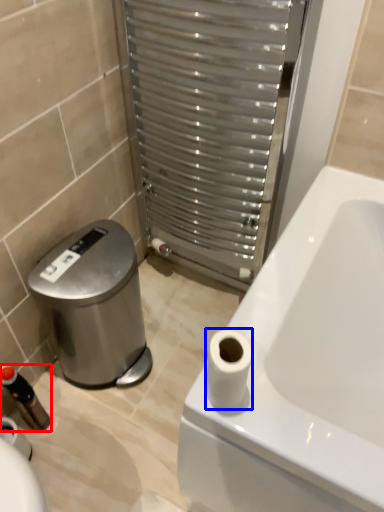
Question: Which object appears closest to the camera in this image, toiletry (highlighted by a red box) or toilet paper (highlighted by a blue box)?

Choices:
 (A) toiletry
 (B) toilet paper

Answer: (B)